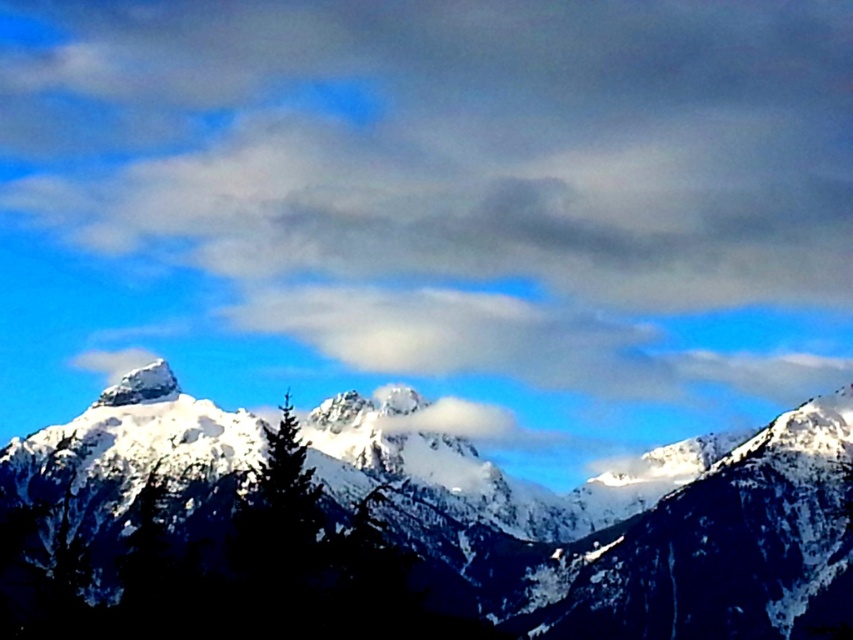
Is white fluffy cloud at upper center closer to the viewer compared to white snow-covered mountain range at center?

No, white fluffy cloud at upper center is further to the viewer.

Identify the location of white fluffy cloud at upper center. (461, 177).

Is point (534, 113) positioned before point (834, 520)?

No, (534, 113) is behind (834, 520).

The image size is (853, 640). Find the location of `white fluffy cloud at upper center`. white fluffy cloud at upper center is located at coordinates (461, 177).

Is white snow-covered mountain range at center bigger than white snow-covered peak at upper center?

Yes.

Does white snow-covered mountain range at center come in front of white snow-covered peak at upper center?

Yes.

Who is more forward, (13, 486) or (112, 388)?

Point (112, 388)

This screenshot has height=640, width=853. In order to click on white snow-covered mountain range at center in this screenshot , I will do `click(613, 525)`.

Can you confirm if white fluffy cloud at upper center is positioned to the left of white snow-covered peak at upper center?

No, white fluffy cloud at upper center is not to the left of white snow-covered peak at upper center.

Is white fluffy cloud at upper center above white snow-covered peak at upper center?

Yes, white fluffy cloud at upper center is above white snow-covered peak at upper center.

Between point (498, 291) and point (114, 392), which one is positioned behind?

Point (498, 291)

Identify the location of white fluffy cloud at upper center. (461, 177).